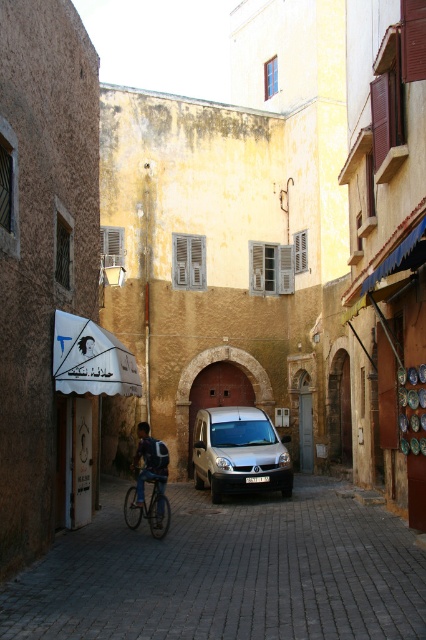
Question: Can you confirm if gray cobblestone alley at center is positioned above blue denim jacket at center?

Choices:
 (A) no
 (B) yes

Answer: (A)

Question: Which point is closer to the camera?

Choices:
 (A) shiny metallic bicycle at center
 (B) blue denim jacket at center
 (C) gray cobblestone alley at center
 (D) white fabric canopy at left

Answer: (C)

Question: Is gray cobblestone alley at center bigger than shiny metallic bicycle at center?

Choices:
 (A) no
 (B) yes

Answer: (B)

Question: Based on their relative distances, which object is nearer to the shiny metallic bicycle at center?

Choices:
 (A) blue denim jacket at center
 (B) white fabric canopy at left
 (C) gray cobblestone alley at center

Answer: (A)

Question: Which point is closer to the camera?

Choices:
 (A) (276, 477)
 (B) (91, 390)

Answer: (B)

Question: Can you confirm if silver metallic van at center is positioned to the left of shiny metallic bicycle at center?

Choices:
 (A) yes
 (B) no

Answer: (B)